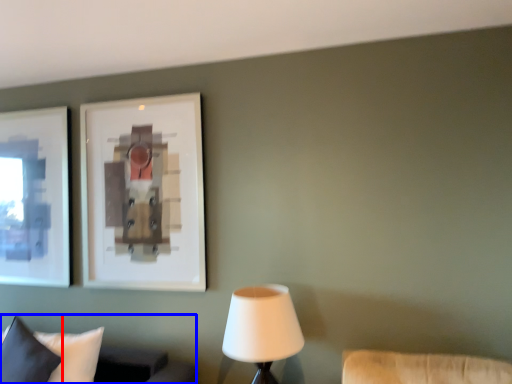
Question: Which object is closer to the camera taking this photo, pillow (highlighted by a red box) or furniture (highlighted by a blue box)?

Choices:
 (A) pillow
 (B) furniture

Answer: (A)